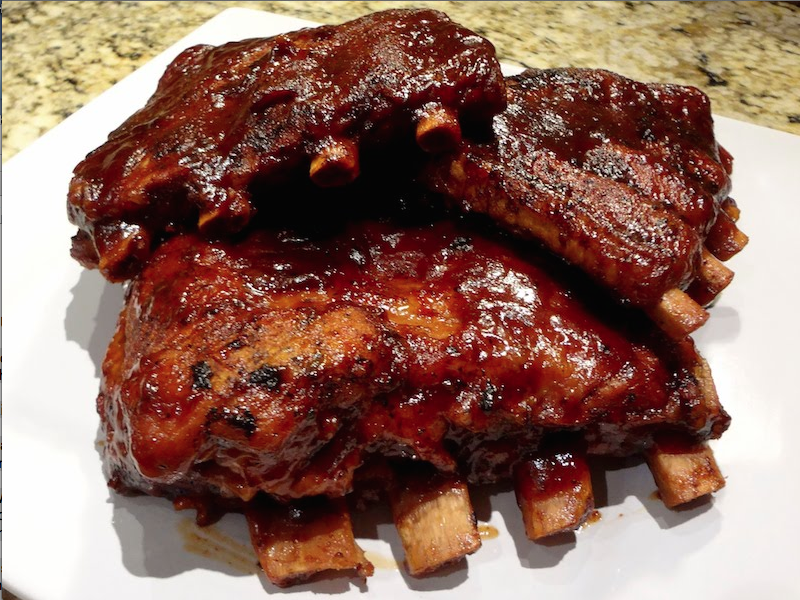
Find the location of `counter`. counter is located at coordinates (50, 51).